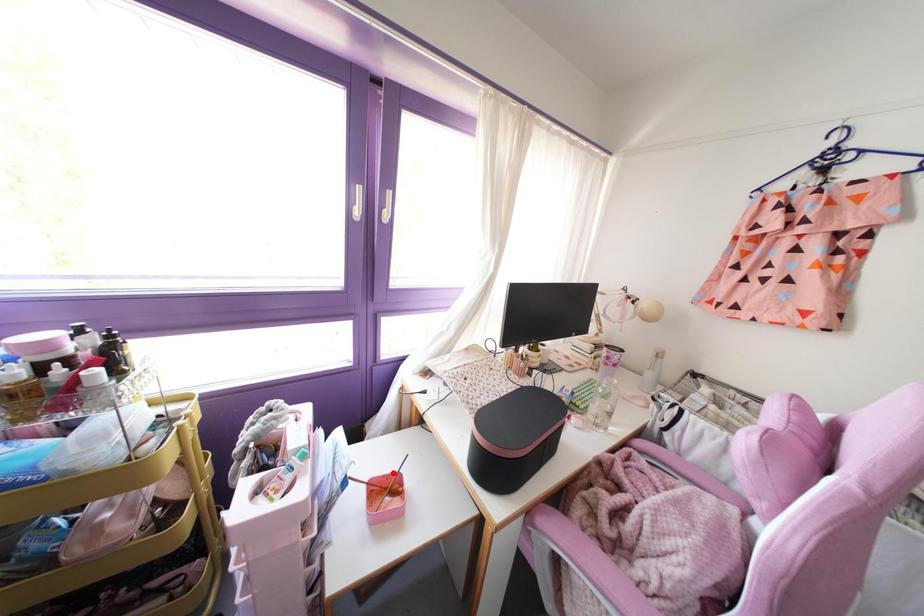
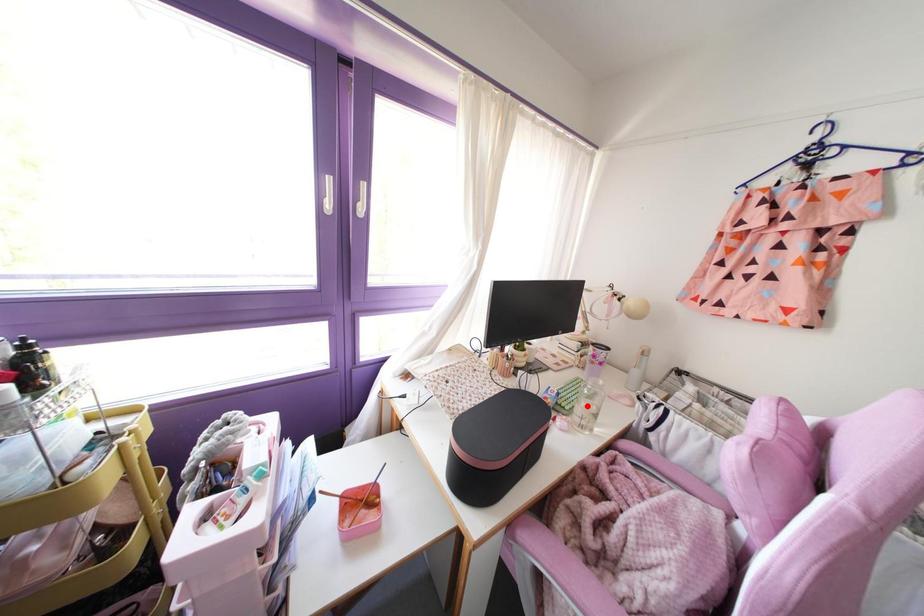
I am providing you with two images of the same scene from different viewpoints. A red point is marked on the first image and another point is marked on the second image. Do the highlighted points in image1 and image2 indicate the same real-world spot?

No